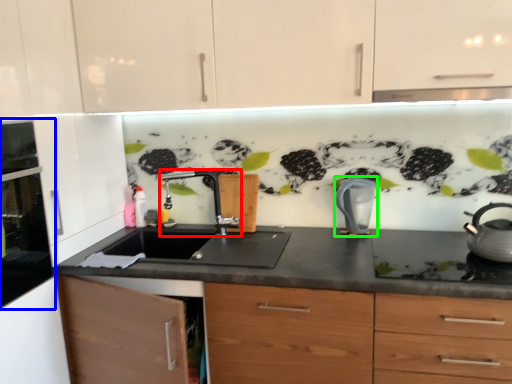
Question: Estimate the real-world distances between objects in this image. Which object is closer to tap (highlighted by a red box), home appliance (highlighted by a blue box) or kitchen appliance (highlighted by a green box)?

Choices:
 (A) home appliance
 (B) kitchen appliance

Answer: (B)